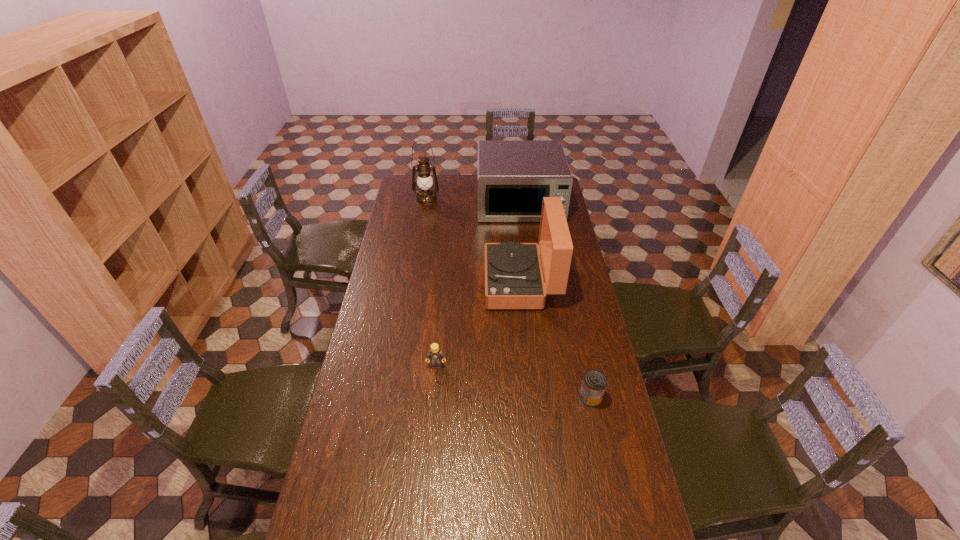
I want to click on object at the far left corner, so click(426, 195).

The width and height of the screenshot is (960, 540). In order to click on object present at the far right corner in this screenshot , I will do `click(513, 175)`.

Locate an element on the screen. The image size is (960, 540). free point at the left edge is located at coordinates (387, 416).

Identify the location of vacant area at the right edge of the desktop. (596, 355).

Where is `free space between the third farthest object and the microwave oven`? The width and height of the screenshot is (960, 540). free space between the third farthest object and the microwave oven is located at coordinates (520, 242).

I want to click on vacant region between the phonograph record and the can, so click(556, 340).

Locate an element on the screen. vacant region between the third farthest object and the nearest object is located at coordinates (556, 340).

Locate an element on the screen. vacant space in between the fourth object from right to left and the shortest object is located at coordinates (514, 381).

Where is `the fourth closest object to the third farthest object`? This screenshot has width=960, height=540. the fourth closest object to the third farthest object is located at coordinates (426, 195).

Locate an element on the screen. The height and width of the screenshot is (540, 960). the third closest object to the Lego is located at coordinates (513, 175).